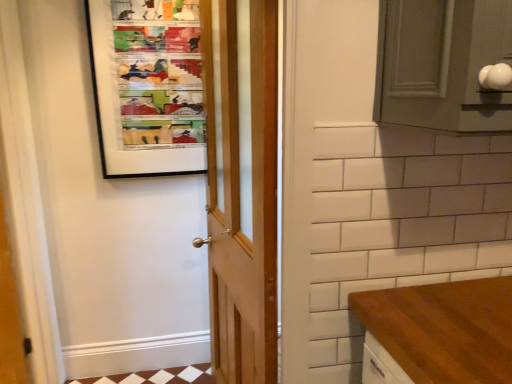
Question: Could you tell me if matte plastic bulletin board at upper left is turned towards wooden door at center?

Choices:
 (A) no
 (B) yes

Answer: (B)

Question: From a real-world perspective, is matte plastic bulletin board at upper left positioned under wooden door at center based on gravity?

Choices:
 (A) no
 (B) yes

Answer: (A)

Question: Does matte plastic bulletin board at upper left have a lesser width compared to wooden door at center?

Choices:
 (A) yes
 (B) no

Answer: (A)

Question: Is matte plastic bulletin board at upper left to the left of wooden door at center from the viewer's perspective?

Choices:
 (A) yes
 (B) no

Answer: (A)

Question: Would you say wooden door at center is part of matte plastic bulletin board at upper left's contents?

Choices:
 (A) yes
 (B) no

Answer: (B)

Question: Considering the relative sizes of matte plastic bulletin board at upper left and wooden door at center in the image provided, is matte plastic bulletin board at upper left bigger than wooden door at center?

Choices:
 (A) no
 (B) yes

Answer: (A)

Question: Is the depth of wooden door at center less than that of matte plastic bulletin board at upper left?

Choices:
 (A) yes
 (B) no

Answer: (A)

Question: Could matte plastic bulletin board at upper left be considered to be inside wooden door at center?

Choices:
 (A) yes
 (B) no

Answer: (B)

Question: Could you tell me if wooden door at center is turned towards matte plastic bulletin board at upper left?

Choices:
 (A) no
 (B) yes

Answer: (A)

Question: Can you confirm if wooden door at center is smaller than matte plastic bulletin board at upper left?

Choices:
 (A) no
 (B) yes

Answer: (A)

Question: Can you confirm if wooden door at center is shorter than matte plastic bulletin board at upper left?

Choices:
 (A) yes
 (B) no

Answer: (B)

Question: Is wooden door at center taller than matte plastic bulletin board at upper left?

Choices:
 (A) no
 (B) yes

Answer: (B)

Question: Is wooden door at center bigger or smaller than matte plastic bulletin board at upper left?

Choices:
 (A) big
 (B) small

Answer: (A)